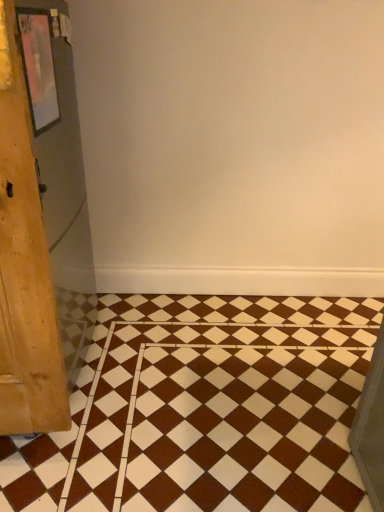
You are a GUI agent. You are given a task and a screenshot of the screen. Output one action in this format:
    pyautogui.click(x=<x>, y=<y>)
    Task: Click on the brown glossy tile at center
    
    Given the screenshot: What is the action you would take?
    pyautogui.click(x=207, y=409)

The height and width of the screenshot is (512, 384). What do you see at coordinates (207, 409) in the screenshot? I see `brown glossy tile at center` at bounding box center [207, 409].

Where is `brown glossy tile at center`? brown glossy tile at center is located at coordinates (207, 409).